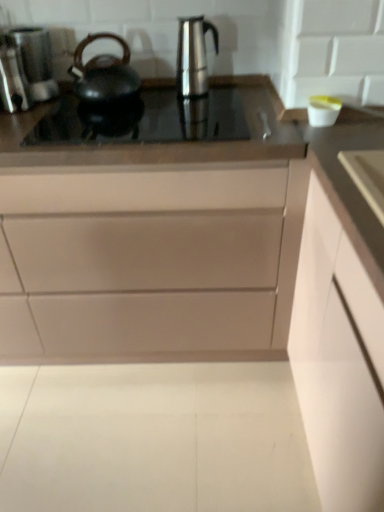
Question: From a real-world perspective, is satin nickel faucet at center over matte white drawer at center, arranged as the 2th cabinetry when viewed from the right?

Choices:
 (A) yes
 (B) no

Answer: (A)

Question: From the image's perspective, is satin nickel faucet at center on matte white drawer at center, arranged as the 2th cabinetry when viewed from the right?

Choices:
 (A) no
 (B) yes

Answer: (B)

Question: Can you confirm if satin nickel faucet at center is wider than matte white drawer at center, arranged as the 2th cabinetry when viewed from the right?

Choices:
 (A) yes
 (B) no

Answer: (B)

Question: Is satin nickel faucet at center positioned far away from matte white drawer at center, arranged as the 2th cabinetry when viewed from the right?

Choices:
 (A) yes
 (B) no

Answer: (B)

Question: Is satin nickel faucet at center facing away from matte white drawer at center, arranged as the 2th cabinetry when viewed from the right?

Choices:
 (A) yes
 (B) no

Answer: (A)

Question: Considering the relative positions of satin nickel faucet at center and matte white drawer at center, arranged as the 2th cabinetry when viewed from the right, in the image provided, is satin nickel faucet at center in front of matte white drawer at center, arranged as the 2th cabinetry when viewed from the right,?

Choices:
 (A) yes
 (B) no

Answer: (B)

Question: From a real-world perspective, is stainless steel coffee pot at center positioned over black matte kettle at left based on gravity?

Choices:
 (A) yes
 (B) no

Answer: (A)

Question: Does stainless steel coffee pot at center have a lesser width compared to black matte kettle at left?

Choices:
 (A) yes
 (B) no

Answer: (A)

Question: Considering the relative sizes of stainless steel coffee pot at center and black matte kettle at left in the image provided, is stainless steel coffee pot at center bigger than black matte kettle at left?

Choices:
 (A) no
 (B) yes

Answer: (A)

Question: From the image's perspective, is stainless steel coffee pot at center under black matte kettle at left?

Choices:
 (A) no
 (B) yes

Answer: (A)

Question: Can you confirm if stainless steel coffee pot at center is positioned to the right of black matte kettle at left?

Choices:
 (A) no
 (B) yes

Answer: (B)

Question: Is stainless steel coffee pot at center positioned behind black matte kettle at left?

Choices:
 (A) yes
 (B) no

Answer: (A)

Question: From a real-world perspective, is stainless steel coffee pot at center on satin nickel faucet at center?

Choices:
 (A) yes
 (B) no

Answer: (A)